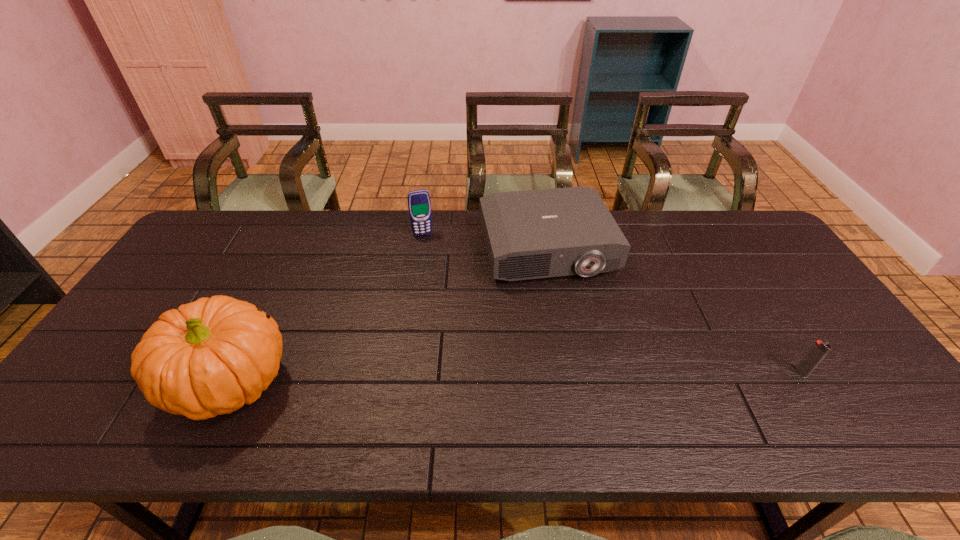
Find the location of a particular element. The image size is (960, 540). vacant space on the desktop that is between the leftmost object and the igniter and is positioned on the front-facing side of the second tallest object is located at coordinates (462, 379).

Where is `vacant spot on the desktop that is between the pumpkin and the rightmost object and is positioned on the front-facing side of the projector`? The height and width of the screenshot is (540, 960). vacant spot on the desktop that is between the pumpkin and the rightmost object and is positioned on the front-facing side of the projector is located at coordinates (596, 376).